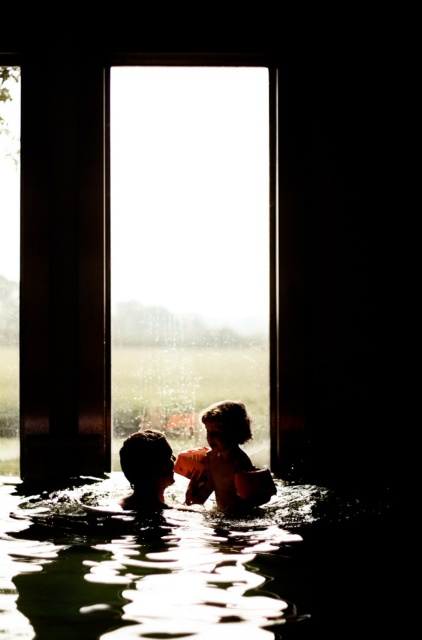
You are a lifeguard on duty and notice two people in the pool. You see the clear liquid water at center and the silky brown hair at center. Which object is shorter?

The clear liquid water at center is shorter than the silky brown hair at center.

You are a photographer trying to capture a closeup of the silky brown hair at center and the clear liquid water at center in the scene. Since the camera can only focus on one subject at a time, which subject should you choose to ensure the other is still in the frame?

The clear liquid water at center is to the right of silky brown hair at center, so you should focus on the silky brown hair at center to keep the clear liquid water at center in the frame.

You are standing at the entrance of the spa and want to pour a drink into the clear liquid water at center. Based on the coordinates provided, where exactly should you aim to pour the drink?

The clear liquid water at center is located at coordinates point (210, 570), so you should aim for that exact point to pour the drink.